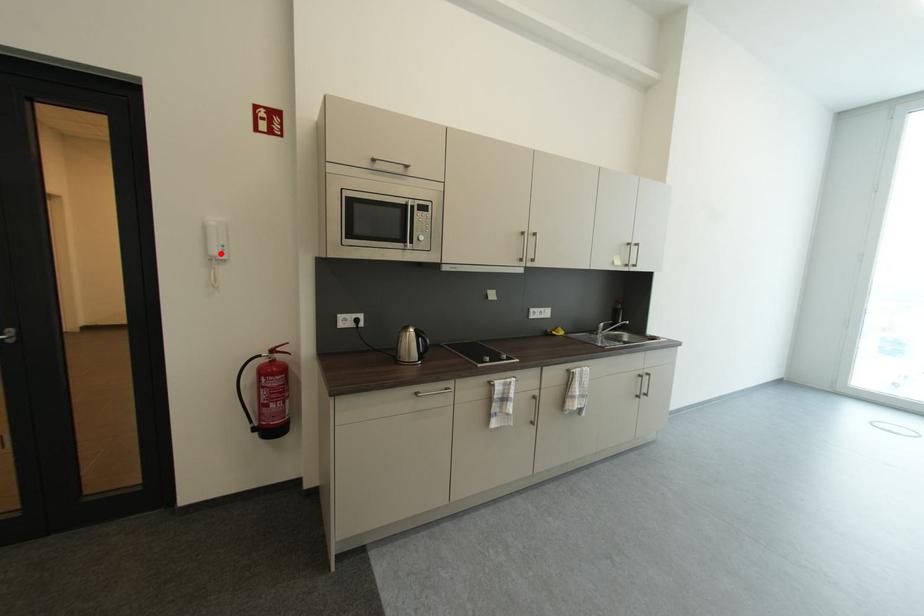
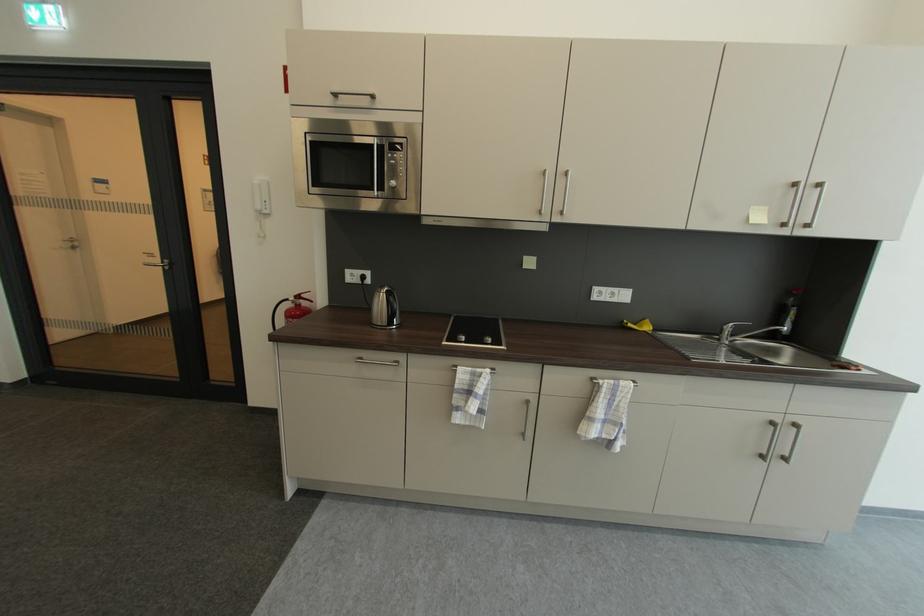
Where in the second image is the point corresponding to the highlighted location from the first image?

(264, 208)